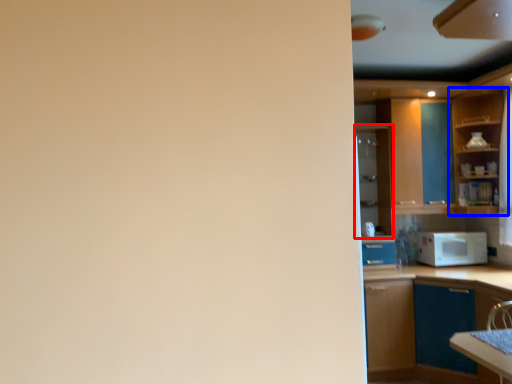
Question: Which of the following is the closest to the observer, cabinetry (highlighted by a red box) or cabinetry (highlighted by a blue box)?

Choices:
 (A) cabinetry
 (B) cabinetry

Answer: (B)